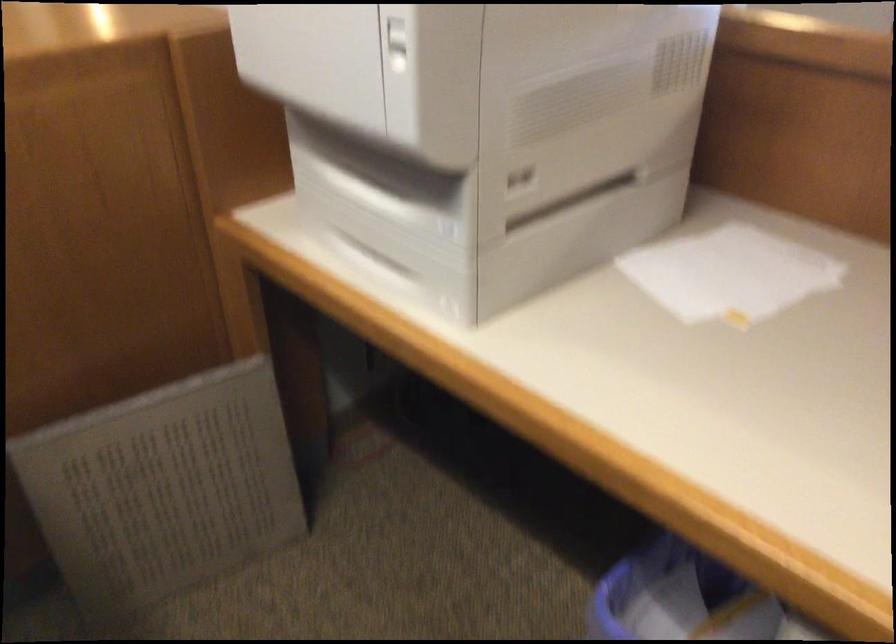
Where is `printer paper tray`? printer paper tray is located at coordinates (391, 220).